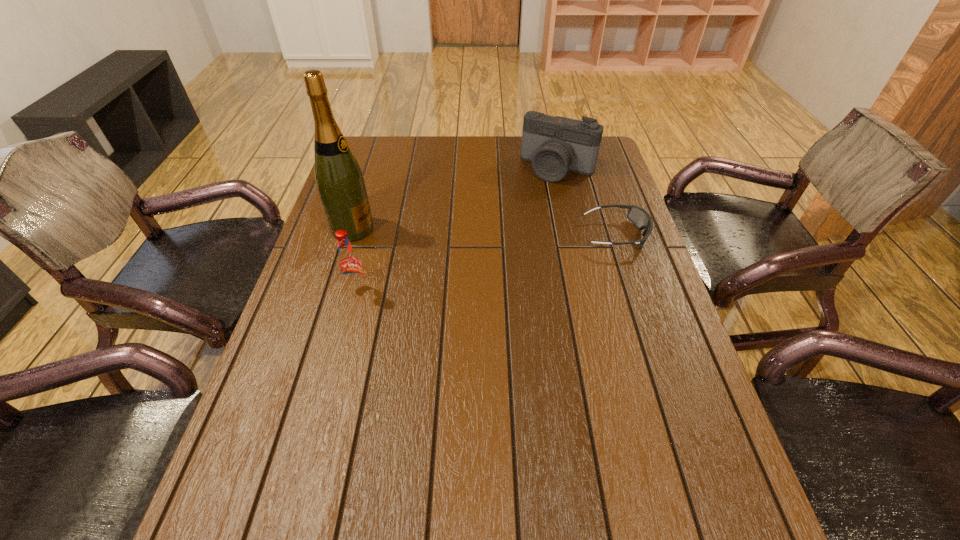
The height and width of the screenshot is (540, 960). I want to click on object that is the closest to the goggles, so click(x=555, y=145).

The width and height of the screenshot is (960, 540). In order to click on vacant area that satisfies the following two spatial constraints: 1. on the back side of the farthest object; 2. on the left side of the root beer in this screenshot , I will do `click(389, 168)`.

Find the location of a particular element. vacant space that satisfies the following two spatial constraints: 1. on the front side of the tallest object; 2. on the right side of the nearest object is located at coordinates (333, 291).

Where is `vacant point that satisfies the following two spatial constraints: 1. on the front side of the farthest object; 2. on the lenses of the shortest object`? The width and height of the screenshot is (960, 540). vacant point that satisfies the following two spatial constraints: 1. on the front side of the farthest object; 2. on the lenses of the shortest object is located at coordinates (573, 235).

The image size is (960, 540). What are the coordinates of `free space that satisfies the following two spatial constraints: 1. on the front side of the shortest object; 2. on the lenses of the tallest object` in the screenshot? It's located at (351, 235).

Where is `free space that satisfies the following two spatial constraints: 1. on the back side of the root beer; 2. on the lenses of the shortest object`? The width and height of the screenshot is (960, 540). free space that satisfies the following two spatial constraints: 1. on the back side of the root beer; 2. on the lenses of the shortest object is located at coordinates [x=372, y=235].

The width and height of the screenshot is (960, 540). In order to click on blank area in the image that satisfies the following two spatial constraints: 1. on the front side of the goggles; 2. on the lenses of the tallest object in this screenshot , I will do `click(351, 235)`.